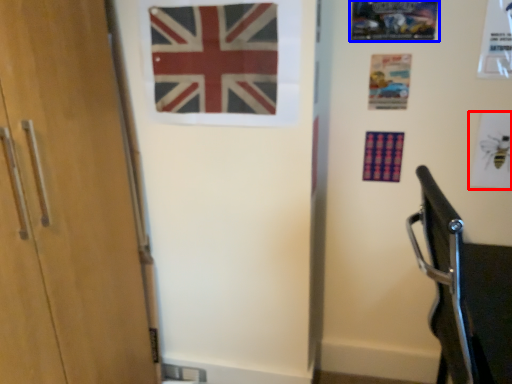
Question: Which object appears closest to the camera in this image, postcard (highlighted by a red box) or postcard (highlighted by a blue box)?

Choices:
 (A) postcard
 (B) postcard

Answer: (B)